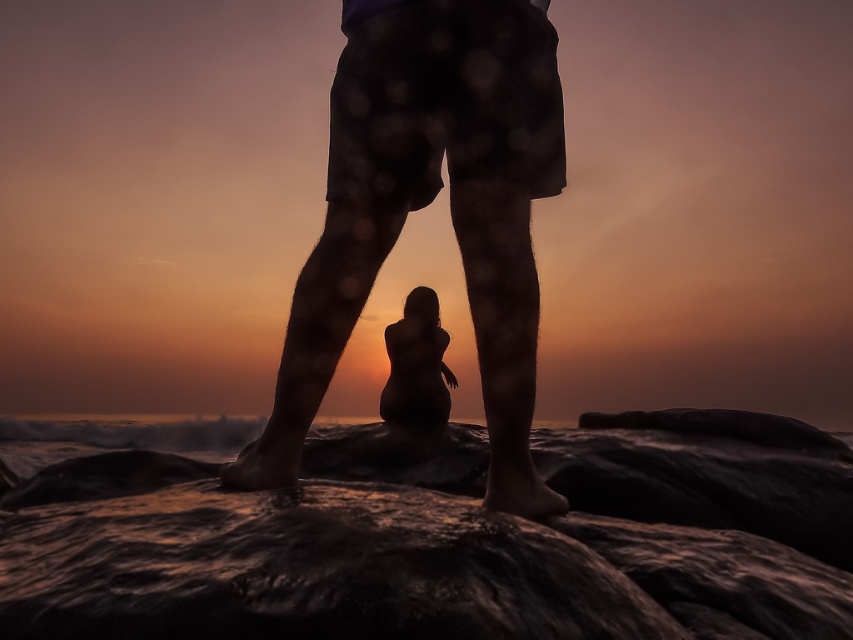
You are a photographer trying to capture the sunset scene. You notice two silhouetted figures at the center of the image. The first is the silhouette shorts at center, and the second is the silhouette figure at center. Based on their positions, which one appears closer to the camera?

The silhouette shorts at center appears closer to the camera because it is located above the silhouette figure at center, indicating it is in a higher position within the scene.

You are standing on the rocky beach and want to take a photo of the sunset. You notice the sandy water at lower center and the silhouette figure at center. Which object in the scene is smaller in size?

The sandy water at lower center is smaller in size compared to the silhouette figure at center.

You are standing on the rocky beach and want to take a photo of the sunset. You notice the sandy water at lower center and the silhouette figure at center. Which object occupies more horizontal space in the photo?

The sandy water at lower center occupies more horizontal space in the photo because its width is larger than that of the silhouette figure at center.